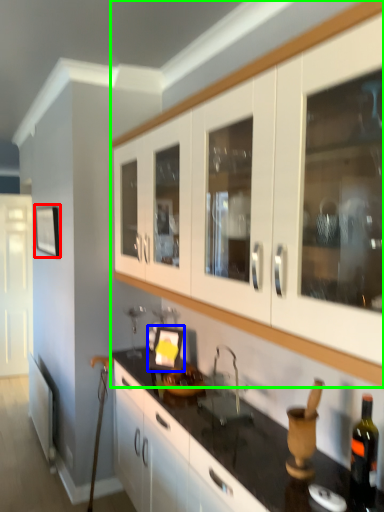
Question: Which object is the farthest from picture frame (highlighted by a red box)? Choose among these: picture frame (highlighted by a blue box) or cabinetry (highlighted by a green box).

Choices:
 (A) picture frame
 (B) cabinetry

Answer: (B)